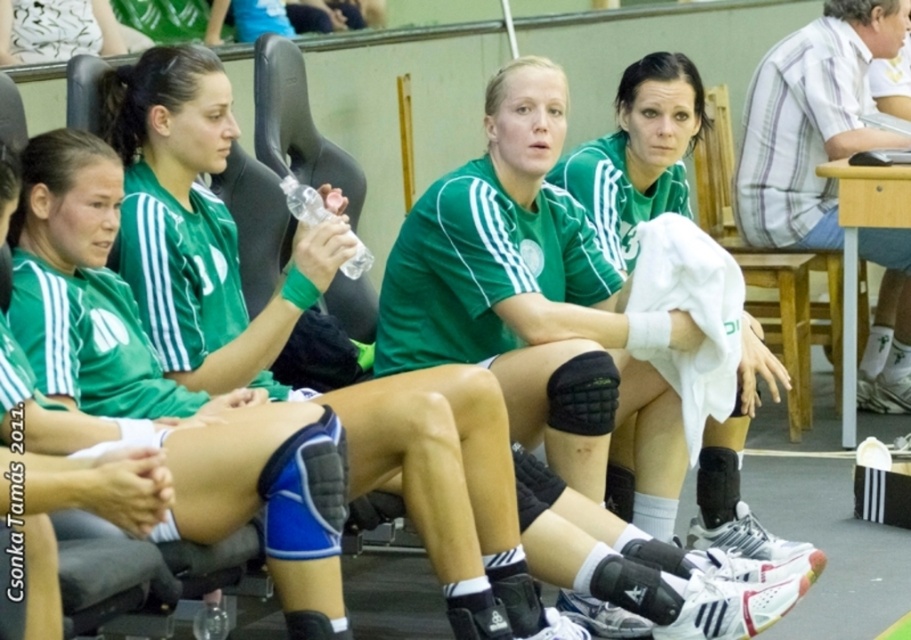
You are an athlete who needs to grab your water bottle. You are currently sitting on the bench and see the matte green jersey at center and the matte green uniform at center. Which one is closer to you?

The matte green jersey at center and matte green uniform at center are 6.94 feet apart from each other, so you need to specify which one is closer to determine the answer.

You are a team manager observing the athletes. You need to determine which item is wider between the matte green jersey at center and the matte green uniform at center. Which one is wider?

The matte green jersey at center is wider than the matte green uniform at center according to the description.